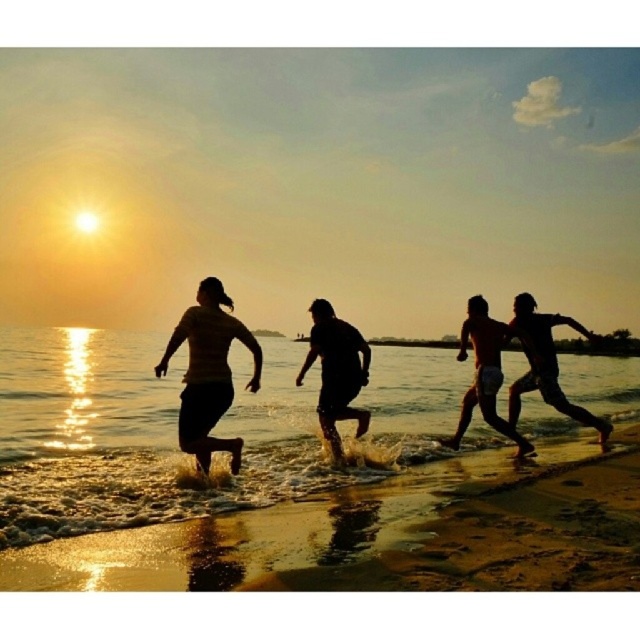
Is point (205, 422) farther from camera compared to point (596, 424)?

No, it is in front of (596, 424).

This screenshot has width=640, height=640. Describe the element at coordinates (209, 372) in the screenshot. I see `matte yellow shirt at center` at that location.

Is point (182, 392) more distant than point (586, 420)?

No, it is not.

I want to click on matte yellow shirt at center, so click(209, 372).

Between dark matte figure at center and smooth skin torso at center, which one appears on the left side from the viewer's perspective?

dark matte figure at center is more to the left.

Between dark matte figure at center and smooth skin torso at center, which one is positioned higher?

dark matte figure at center is higher up.

Does point (348, 365) come in front of point (483, 310)?

That is True.

Where is `dark matte figure at center`? Image resolution: width=640 pixels, height=640 pixels. dark matte figure at center is located at coordinates (337, 371).

How much distance is there between dark matte figure at center and silhouette running man at right?

A distance of 2.91 meters exists between dark matte figure at center and silhouette running man at right.

Between dark matte figure at center and silhouette running man at right, which one has less height?

silhouette running man at right is shorter.

What do you see at coordinates (337, 371) in the screenshot?
I see `dark matte figure at center` at bounding box center [337, 371].

At what (x,y) coordinates should I click in order to perform the action: click on dark matte figure at center. Please return your answer as a coordinate pair (x, y). Looking at the image, I should click on (337, 371).